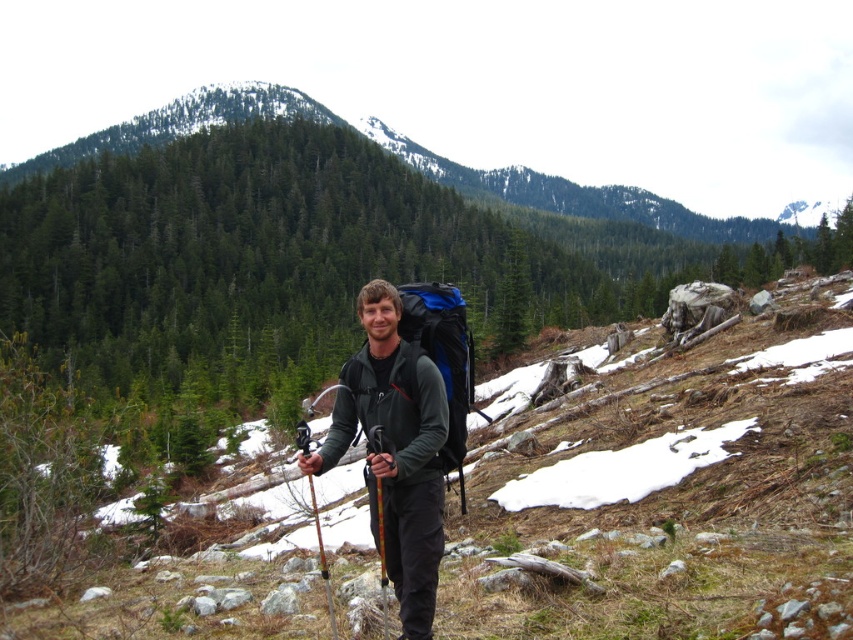
You are a hiker trying to pack your gear. You have a small backpack compartment. Which item between the matte black jacket at center and the matte black ski pole at center would fit better in the compartment?

The matte black jacket at center occupies less space than the matte black ski pole at center, so it would fit better in the small backpack compartment.

You are a drone operator trying to capture a photo of the hiker from above. You need to fly your drone between two points marked as point 1 at (374, 410) and point 2 at (331, 602). Which point should you choose to ensure the drone stays closer to the hiker?

Point 1 at (374, 410) is closer to the hiker because it is further to the viewer than point 2 at (331, 602), meaning it is physically nearer in the scene.

You are a photographer trying to capture the wooden textured ski pole at center in your shot. The camera you are using has a focal length of 50mm and is positioned at a height of 1.5 meters. Given the terrain described in the scene, what potential challenges might you face in framing the shot?

The wooden textured ski pole at center is located at coordinates [381,556]. Potential challenges include uneven terrain with rocks and snow patches, which may complicate camera stabilization, and the dense coniferous forest background that could make it difficult to isolate the ski pole in the frame.